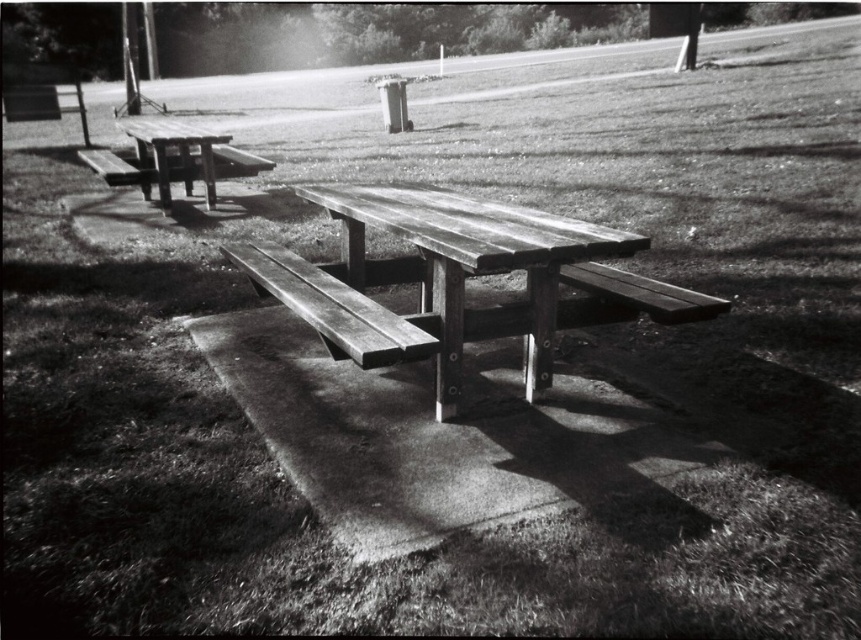
You are standing in the park and want to sit down. You see the wooden bench at center and the wooden picnic table at left. Which one is closer to you?

The wooden bench at center is closer to the viewer than the wooden picnic table at left, so you should choose the wooden bench at center.

You are planning to set up a small tablecloth on the wooden picnic table at center and want to ensure it doesn t hang over the edge near the wooden bench at center. What is the minimum length the tablecloth should have between the edge of the picnic table and the bench to avoid touching the bench?

The wooden picnic table at center and wooden bench at center are 17.06 inches apart. To prevent the tablecloth from hanging over the edge and touching the bench, the tablecloth should be at least 17.06 inches in length between the edge of the picnic table and the bench.

You are planning to sit on the wooden bench at center and the wooden picnic table at left. Which one will require you to climb higher to sit on?

The wooden bench at center has a greater height compared to the wooden picnic table at left, so you will need to climb higher to sit on the wooden bench at center.